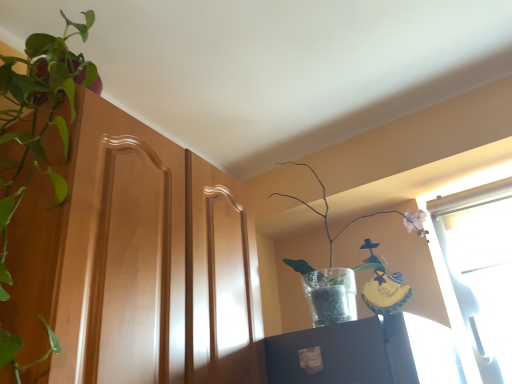
Where is `green leafy plant at left, arranged as the 2th houseplant when viewed from the right`? This screenshot has height=384, width=512. green leafy plant at left, arranged as the 2th houseplant when viewed from the right is located at coordinates (37, 118).

Where is `wooden cabinet at left`? Image resolution: width=512 pixels, height=384 pixels. wooden cabinet at left is located at coordinates (126, 251).

From the image's perspective, does green leafy plant at left, the first houseplant positioned from the left, appear lower than wooden cabinet at left?

No, from the image's perspective, green leafy plant at left, the first houseplant positioned from the left, is not below wooden cabinet at left.

Does green leafy plant at left, arranged as the 2th houseplant when viewed from the right, contain wooden cabinet at left?

That's incorrect, wooden cabinet at left is not inside green leafy plant at left, arranged as the 2th houseplant when viewed from the right.

Is wooden cabinet at left at the back of green leafy plant at left, arranged as the 2th houseplant when viewed from the right?

Absolutely, green leafy plant at left, arranged as the 2th houseplant when viewed from the right, is directed away from wooden cabinet at left.

From a real-world perspective, which houseplant is the 2nd one above the wooden cabinet at left? Please provide its 2D coordinates.

[(37, 118)]

Based on the photo, is wooden cabinet at left not close to green leafy plant at left, arranged as the 2th houseplant when viewed from the right?

No, wooden cabinet at left is in close proximity to green leafy plant at left, arranged as the 2th houseplant when viewed from the right.

What's the angular difference between wooden cabinet at left and green leafy plant at left, the first houseplant positioned from the left,'s facing directions?

91.1 degrees separate the facing orientations of wooden cabinet at left and green leafy plant at left, the first houseplant positioned from the left.

Is the position of wooden cabinet at left less distant than that of green leafy plant at left, arranged as the 2th houseplant when viewed from the right?

No, the depth of wooden cabinet at left is greater than that of green leafy plant at left, arranged as the 2th houseplant when viewed from the right.

Is wooden cabinet at left not within green leafy plant at left, the first houseplant positioned from the left?

Yes.

Which object is more forward, green leafy plant at left, arranged as the 2th houseplant when viewed from the right, or translucent glass vase at upper right, positioned as the first houseplant in right-to-left order?

green leafy plant at left, arranged as the 2th houseplant when viewed from the right, is closer to the camera.

Can we say green leafy plant at left, arranged as the 2th houseplant when viewed from the right, lies outside translucent glass vase at upper right, positioned as the first houseplant in right-to-left order?

Yes.

Does green leafy plant at left, the first houseplant positioned from the left, have a greater height compared to translucent glass vase at upper right, positioned as the first houseplant in right-to-left order?

Indeed, green leafy plant at left, the first houseplant positioned from the left, has a greater height compared to translucent glass vase at upper right, positioned as the first houseplant in right-to-left order.

Does green leafy plant at left, arranged as the 2th houseplant when viewed from the right, have a smaller size compared to translucent glass vase at upper right, positioned as the first houseplant in right-to-left order?

Incorrect, green leafy plant at left, arranged as the 2th houseplant when viewed from the right, is not smaller in size than translucent glass vase at upper right, positioned as the first houseplant in right-to-left order.

Is translucent glass vase at upper right, the 2th houseplant viewed from the left, wider than wooden cabinet at left?

In fact, translucent glass vase at upper right, the 2th houseplant viewed from the left, might be narrower than wooden cabinet at left.

Which object is more forward, translucent glass vase at upper right, positioned as the first houseplant in right-to-left order, or wooden cabinet at left?

wooden cabinet at left is in front.

Is point (346, 224) farther from viewer compared to point (112, 263)?

Yes, point (346, 224) is farther from viewer.

From a real-world perspective, between wooden cabinet at left and translucent glass vase at upper right, the 2th houseplant viewed from the left, who is vertically higher?

In real-world perspective, translucent glass vase at upper right, the 2th houseplant viewed from the left, is above.

In the scene shown: In the image, is wooden cabinet at left positioned in front of or behind translucent glass vase at upper right, the 2th houseplant viewed from the left?

Visually, wooden cabinet at left is located in front of translucent glass vase at upper right, the 2th houseplant viewed from the left.

Who is smaller, wooden cabinet at left or translucent glass vase at upper right, the 2th houseplant viewed from the left?

With smaller size is translucent glass vase at upper right, the 2th houseplant viewed from the left.

Looking at their sizes, would you say wooden cabinet at left is wider or thinner than translucent glass vase at upper right, the 2th houseplant viewed from the left?

Considering their sizes, wooden cabinet at left looks broader than translucent glass vase at upper right, the 2th houseplant viewed from the left.

Consider the image. Does translucent glass vase at upper right, positioned as the first houseplant in right-to-left order, appear on the right side of green leafy plant at left, the first houseplant positioned from the left?

Indeed, translucent glass vase at upper right, positioned as the first houseplant in right-to-left order, is positioned on the right side of green leafy plant at left, the first houseplant positioned from the left.

Is translucent glass vase at upper right, the 2th houseplant viewed from the left, positioned beyond the bounds of green leafy plant at left, arranged as the 2th houseplant when viewed from the right?

Absolutely, translucent glass vase at upper right, the 2th houseplant viewed from the left, is external to green leafy plant at left, arranged as the 2th houseplant when viewed from the right.

Does translucent glass vase at upper right, positioned as the first houseplant in right-to-left order, have a smaller size compared to green leafy plant at left, arranged as the 2th houseplant when viewed from the right?

Yes.

Considering the positions of points (407, 225) and (6, 118), is point (407, 225) farther from camera compared to point (6, 118)?

Yes, point (407, 225) is farther from viewer.

Locate an element on the screen. the 2nd houseplant above when counting from the wooden cabinet at left (from the image's perspective) is located at coordinates (37, 118).

The width and height of the screenshot is (512, 384). I want to click on screen door on the right of green leafy plant at left, arranged as the 2th houseplant when viewed from the right, so click(126, 251).

When comparing their distances from wooden cabinet at left, does green leafy plant at left, the first houseplant positioned from the left, or translucent glass vase at upper right, the 2th houseplant viewed from the left, seem closer?

green leafy plant at left, the first houseplant positioned from the left, is closer to wooden cabinet at left.

Looking at the image, which one is located further to green leafy plant at left, arranged as the 2th houseplant when viewed from the right, translucent glass vase at upper right, the 2th houseplant viewed from the left, or wooden cabinet at left?

translucent glass vase at upper right, the 2th houseplant viewed from the left, lies further to green leafy plant at left, arranged as the 2th houseplant when viewed from the right, than the other object.

Looking at the image, which one is located closer to wooden cabinet at left, translucent glass vase at upper right, the 2th houseplant viewed from the left, or green leafy plant at left, the first houseplant positioned from the left?

green leafy plant at left, the first houseplant positioned from the left.

Considering their positions, is green leafy plant at left, arranged as the 2th houseplant when viewed from the right, positioned closer to translucent glass vase at upper right, the 2th houseplant viewed from the left, than wooden cabinet at left?

Among the two, wooden cabinet at left is located nearer to translucent glass vase at upper right, the 2th houseplant viewed from the left.

Considering their positions, is wooden cabinet at left positioned further to translucent glass vase at upper right, positioned as the first houseplant in right-to-left order, than green leafy plant at left, arranged as the 2th houseplant when viewed from the right?

Among the two, green leafy plant at left, arranged as the 2th houseplant when viewed from the right, is located further to translucent glass vase at upper right, positioned as the first houseplant in right-to-left order.

Estimate the real-world distances between objects in this image. Which object is closer to green leafy plant at left, the first houseplant positioned from the left, wooden cabinet at left or translucent glass vase at upper right, positioned as the first houseplant in right-to-left order?

The object closer to green leafy plant at left, the first houseplant positioned from the left, is wooden cabinet at left.

Where is `screen door situated between green leafy plant at left, arranged as the 2th houseplant when viewed from the right, and translucent glass vase at upper right, the 2th houseplant viewed from the left, from left to right`? The width and height of the screenshot is (512, 384). screen door situated between green leafy plant at left, arranged as the 2th houseplant when viewed from the right, and translucent glass vase at upper right, the 2th houseplant viewed from the left, from left to right is located at coordinates (126, 251).